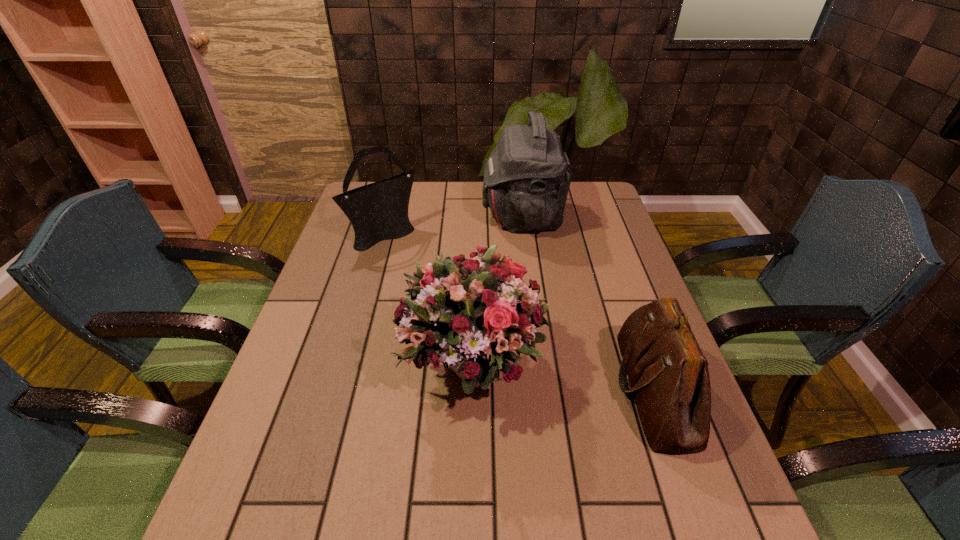
I want to click on vacant area that lies between the shortest shoulder bag and the second shoulder bag from left to right, so click(588, 303).

Where is `vacant space that's between the second shoulder bag from left to right and the leftmost shoulder bag`? This screenshot has width=960, height=540. vacant space that's between the second shoulder bag from left to right and the leftmost shoulder bag is located at coordinates (454, 225).

Identify which object is the third nearest to the nearest shoulder bag. Please provide its 2D coordinates. Your answer should be formatted as a tuple, i.e. [(x, y)], where the tuple contains the x and y coordinates of a point satisfying the conditions above.

[(378, 211)]

Identify the location of object that is the third closest to the bouquet. This screenshot has width=960, height=540. (527, 177).

Choose which shoulder bag is the second nearest neighbor to the bouquet. Please provide its 2D coordinates. Your answer should be formatted as a tuple, i.e. [(x, y)], where the tuple contains the x and y coordinates of a point satisfying the conditions above.

[(378, 211)]

Image resolution: width=960 pixels, height=540 pixels. I want to click on shoulder bag that is the third nearest to the bouquet, so click(x=527, y=177).

The width and height of the screenshot is (960, 540). I want to click on blank area in the image that satisfies the following two spatial constraints: 1. on the open flap of the nearest shoulder bag; 2. on the right side of the second shoulder bag from left to right, so click(546, 389).

Locate an element on the screen. The height and width of the screenshot is (540, 960). free space that satisfies the following two spatial constraints: 1. on the front side of the bouquet; 2. on the left side of the leftmost object is located at coordinates (348, 366).

Identify the location of free spot that satisfies the following two spatial constraints: 1. on the open flap of the second shoulder bag from right to left; 2. on the right side of the shortest shoulder bag. (546, 389).

I want to click on blank space that satisfies the following two spatial constraints: 1. on the open flap of the second shoulder bag from right to left; 2. on the front side of the bouquet, so click(x=542, y=366).